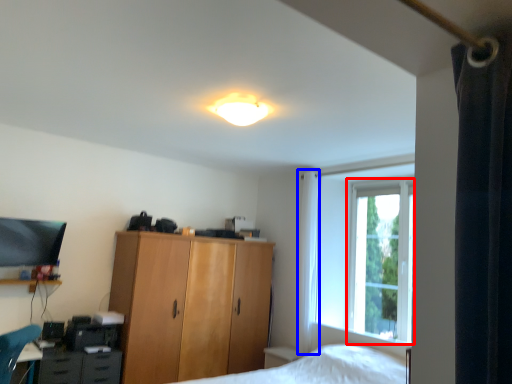
Question: Which of the following is the farthest to the observer, window screen (highlighted by a red box) or curtain (highlighted by a blue box)?

Choices:
 (A) window screen
 (B) curtain

Answer: (B)